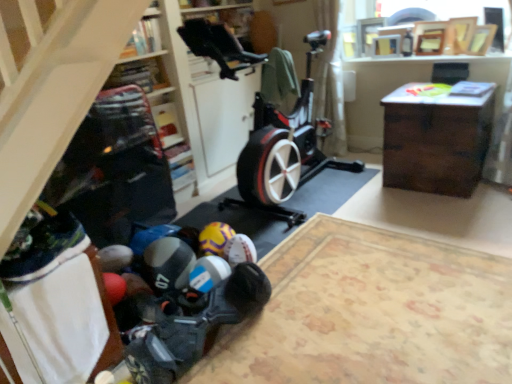
You are a GUI agent. You are given a task and a screenshot of the screen. Output one action in this format:
    pyautogui.click(x=<x>, y=<y>)
    Task: Click on the vacant space in between dark wood desk at right and wooden cabinet at center
    The height and width of the screenshot is (384, 512).
    Given the screenshot: What is the action you would take?
    coord(347,226)